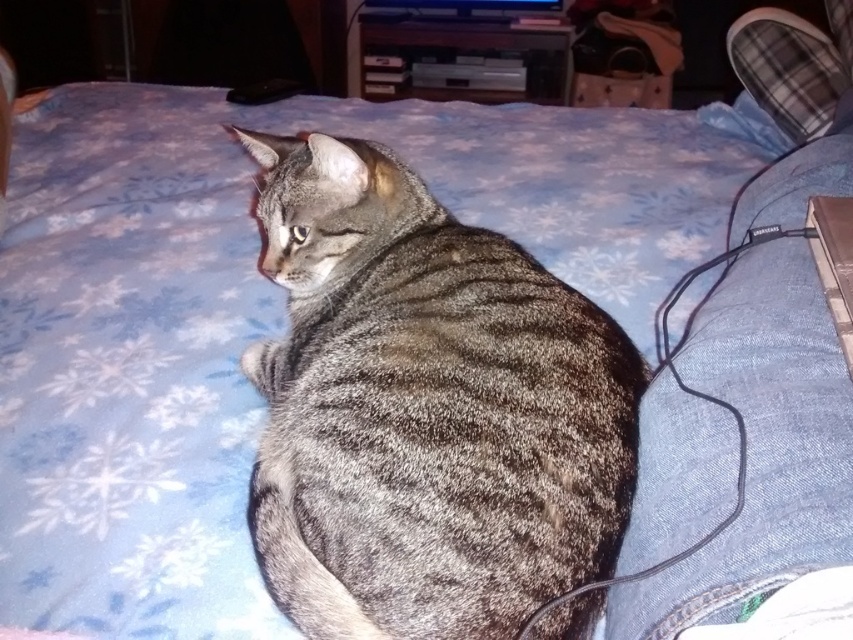
You are a delivery robot entering a room and need to place a small package between the denim at lower right and the black matte laptop at upper right. Can you fit the package between them without moving either object?

The denim at lower right is wider than the black matte laptop at upper right. Since the package needs to be placed between them, the width difference might allow space, but the exact placement depends on their positions. However, the description only mentions width comparison, not distance between them. Without knowing the distance, it is uncertain if the package can fit.

You are a robotic arm trying to pick up an object near the tabby cat on the bed. The robotic arm can only reach coordinates within 0.3 units from the point specified. Is the point at coordinate point (761, 445) within 0.3 units of the tabby cat on the bed?

The point at coordinate point (761, 445) is on denim at lower right, so it is not near the tabby cat on the bed. The robotic arm should not attempt to pick up the object there.